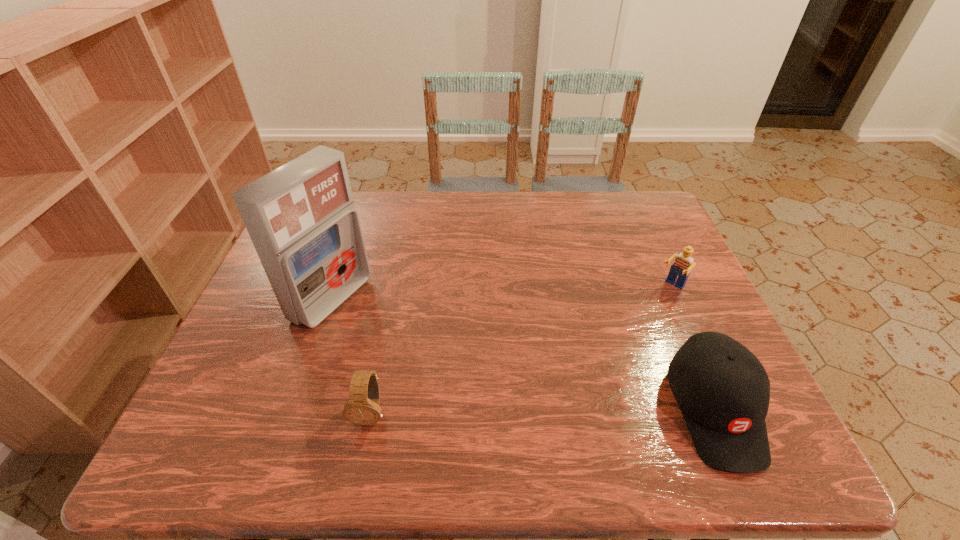
Locate an element on the screen. The image size is (960, 540). free space on the desktop that is between the third object from right to left and the baseball cap and is positioned on the front-facing side of the tallest object is located at coordinates (565, 411).

Locate an element on the screen. The width and height of the screenshot is (960, 540). vacant space on the desktop that is between the third object from right to left and the baseball cap and is positioned on the face of the Lego is located at coordinates (545, 411).